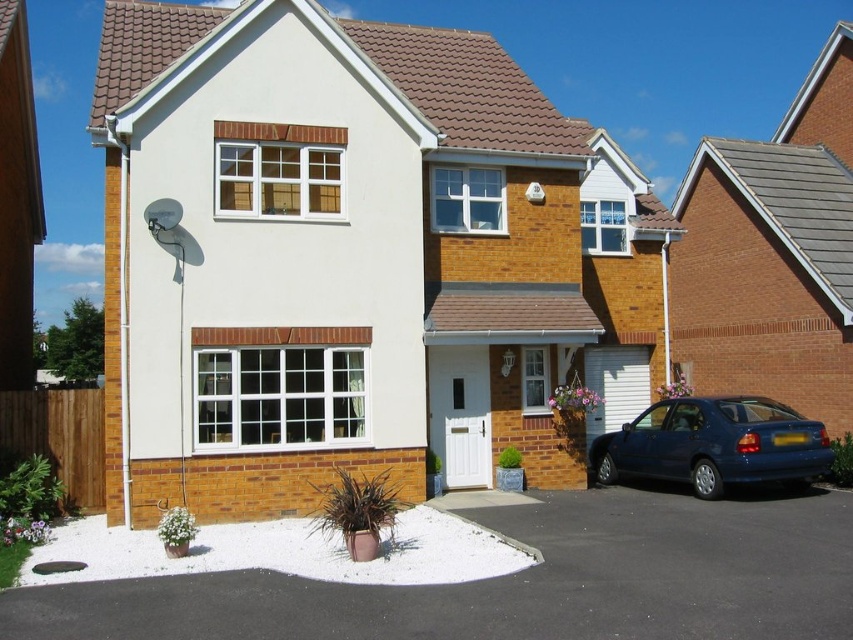
Question: Among these objects, which one is nearest to the camera?

Choices:
 (A) glossy blue sedan at lower right
 (B) black asphalt driveway at lower center

Answer: (B)

Question: Among these points, which one is nearest to the camera?

Choices:
 (A) (780, 481)
 (B) (601, 589)

Answer: (B)

Question: Can you confirm if black asphalt driveway at lower center is thinner than glossy blue sedan at lower right?

Choices:
 (A) no
 (B) yes

Answer: (A)

Question: Is black asphalt driveway at lower center below glossy blue sedan at lower right?

Choices:
 (A) no
 (B) yes

Answer: (B)

Question: Does black asphalt driveway at lower center have a larger size compared to glossy blue sedan at lower right?

Choices:
 (A) yes
 (B) no

Answer: (A)